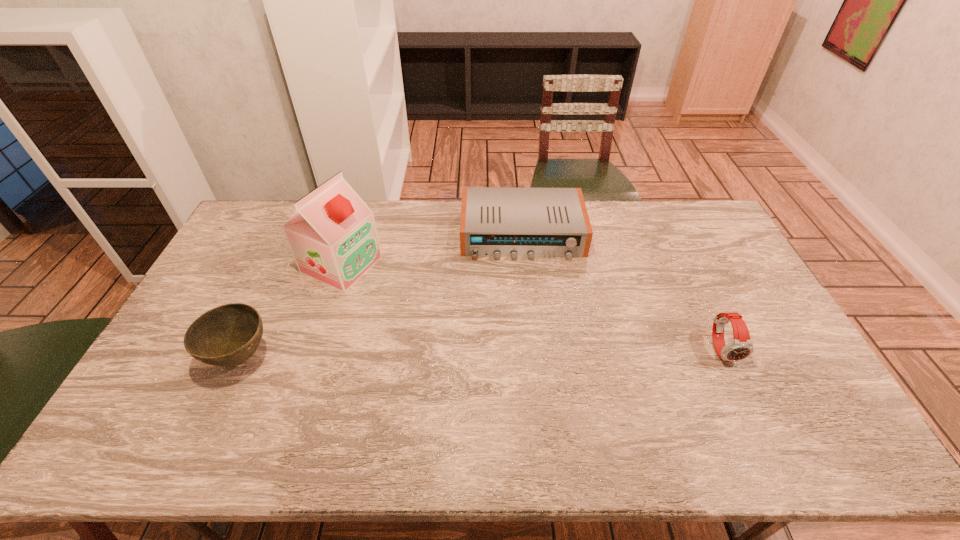
Find the location of a particular element. free space at the right edge is located at coordinates (700, 259).

You are a GUI agent. You are given a task and a screenshot of the screen. Output one action in this format:
    pyautogui.click(x=<x>, y=<y>)
    Task: Click on the blank space at the far left corner of the desktop
    This screenshot has width=960, height=540.
    Given the screenshot: What is the action you would take?
    pyautogui.click(x=262, y=206)

I want to click on free spot at the near left corner of the desktop, so click(x=186, y=397).

This screenshot has height=540, width=960. I want to click on free region at the far right corner of the desktop, so click(670, 217).

Find the location of a particular element. The width and height of the screenshot is (960, 540). unoccupied area between the bowl and the soya milk is located at coordinates (291, 311).

Locate an element on the screen. This screenshot has width=960, height=540. unoccupied position between the soya milk and the bowl is located at coordinates (291, 311).

Where is `vacant area between the third object from left to right and the rightmost object`? vacant area between the third object from left to right and the rightmost object is located at coordinates (622, 292).

Where is `free point between the bowl and the shortest object`? free point between the bowl and the shortest object is located at coordinates (381, 296).

Locate an element on the screen. The width and height of the screenshot is (960, 540). vacant space that is in between the watch and the shortest object is located at coordinates (622, 292).

Find the location of a particular element. This screenshot has width=960, height=540. free spot between the tallest object and the watch is located at coordinates (532, 307).